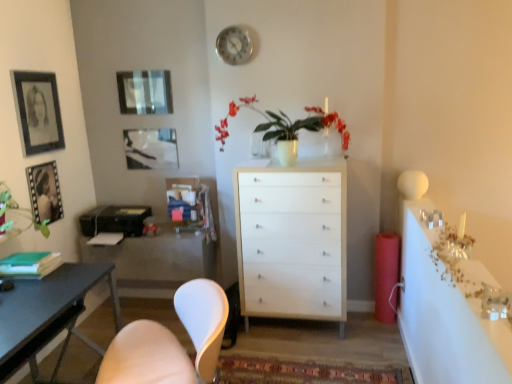
Question: Would you say white matte chair at lower left is inside or outside metallic silver clock at upper center?

Choices:
 (A) outside
 (B) inside

Answer: (A)

Question: Relative to metallic silver clock at upper center, is white matte chair at lower left in front or behind?

Choices:
 (A) front
 (B) behind

Answer: (A)

Question: Considering the real-world distances, which object is farthest from the white matte chair at lower left?

Choices:
 (A) matte black picture frame at left, the 3th picture frame viewed from the right
 (B) white glossy vase at center
 (C) white glossy countertop at right
 (D) matte white cabinet at center
 (E) white wood chest of drawers at center

Answer: (A)

Question: Which of these objects is positioned closest to the matte glass picture frame at upper center, the 3th picture frame positioned from the left?

Choices:
 (A) metallic silver clock at upper center
 (B) matte black picture frame at left, marked as the second picture frame in a left-to-right arrangement
 (C) white matte chair at lower left
 (D) white glossy vase at center
 (E) white wood chest of drawers at center

Answer: (A)